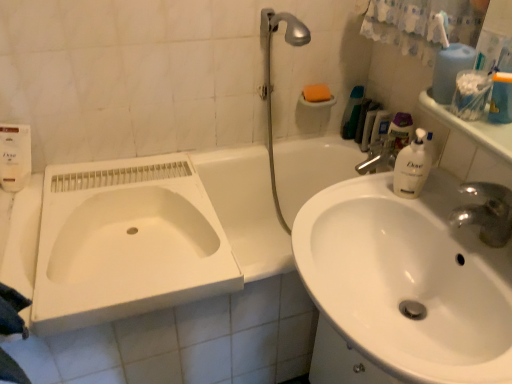
Image resolution: width=512 pixels, height=384 pixels. Describe the element at coordinates (362, 120) in the screenshot. I see `green matte toothpaste tube at upper right, the 2th toiletry from the right` at that location.

Measure the distance between white plastic container at upper right and camera.

A distance of 31.30 inches exists between white plastic container at upper right and camera.

This screenshot has width=512, height=384. What do you see at coordinates (401, 131) in the screenshot? I see `white plastic bottle at upper right, placed as the first toiletry when sorted from right to left` at bounding box center [401, 131].

Measure the distance between point (335, 228) and camera.

Point (335, 228) and camera are 1.03 meters apart.

The width and height of the screenshot is (512, 384). Describe the element at coordinates (316, 93) in the screenshot. I see `orange matte soap at upper center` at that location.

At what (x,y) coordinates should I click in order to perform the action: click on green matte toothpaste tube at upper right, the 2th toiletry from the right. Please return your answer as a coordinate pair (x, y). Looking at the image, I should click on (362, 120).

Is white glossy sink at right in contact with orange matte soap at upper center?

No, white glossy sink at right is not making contact with orange matte soap at upper center.

From a real-world perspective, which is physically below, white glossy sink at right or orange matte soap at upper center?

white glossy sink at right is physically lower.

From the image's perspective, relative to orange matte soap at upper center, is white glossy sink at right above or below?

Clearly, from the image's perspective, white glossy sink at right is below orange matte soap at upper center.

Is white glossy sink at right completely or partially outside of orange matte soap at upper center?

That's correct, white glossy sink at right is outside of orange matte soap at upper center.

Image resolution: width=512 pixels, height=384 pixels. What are the coordinates of `the 1st toiletry located beneath the silver metallic shower head at upper right (from a real-world perspective)` in the screenshot? It's located at (362, 120).

Who is taller, silver metallic shower head at upper right or green matte toothpaste tube at upper right, which appears as the first toiletry when viewed from the left?

With more height is silver metallic shower head at upper right.

From a real-world perspective, is silver metallic shower head at upper right below green matte toothpaste tube at upper right, which appears as the first toiletry when viewed from the left?

Actually, silver metallic shower head at upper right is physically above green matte toothpaste tube at upper right, which appears as the first toiletry when viewed from the left, in the real world.

Is silver metallic shower head at upper right facing away from green matte toothpaste tube at upper right, the 2th toiletry from the right?

No, green matte toothpaste tube at upper right, the 2th toiletry from the right, is not at the back of silver metallic shower head at upper right.

What's the angular difference between silver metallic shower head at upper right and orange matte soap at upper center's facing directions?

silver metallic shower head at upper right and orange matte soap at upper center are facing 0.828 degrees away from each other.

Is point (265, 99) positioned before point (321, 96)?

Yes, point (265, 99) is in front of point (321, 96).

Is silver metallic shower head at upper right thinner than orange matte soap at upper center?

No.

From a real-world perspective, is silver metallic shower head at upper right on orange matte soap at upper center?

No.

How different are the orientations of white glossy bathtub at center and white glossy sink at right in degrees?

The angle between the facing direction of white glossy bathtub at center and the facing direction of white glossy sink at right is 91.8 degrees.

Does white glossy bathtub at center have a greater height compared to white glossy sink at right?

Yes.

Is there a large distance between white glossy bathtub at center and white glossy sink at right?

No, white glossy bathtub at center is not far from white glossy sink at right.

Locate an element on the screen. This screenshot has height=384, width=512. sink that is in front of the white glossy bathtub at center is located at coordinates (402, 286).

Which object is positioned more to the right, white glossy sink at right or white plastic bottle at upper right, the second toiletry in the left-to-right sequence?

Positioned to the right is white plastic bottle at upper right, the second toiletry in the left-to-right sequence.

Based on the photo, is white glossy sink at right placed right next to white plastic bottle at upper right, the second toiletry in the left-to-right sequence?

white glossy sink at right is not next to white plastic bottle at upper right, the second toiletry in the left-to-right sequence, and they're not touching.

Is white glossy sink at right oriented away from white plastic bottle at upper right, the second toiletry in the left-to-right sequence?

No, white glossy sink at right is not facing away from white plastic bottle at upper right, the second toiletry in the left-to-right sequence.

At what (x,y) coordinates should I click in order to perform the action: click on sink that appears above the green matte toothpaste tube at upper right, the 2th toiletry from the right (from a real-world perspective). Please return your answer as a coordinate pair (x, y). Looking at the image, I should click on (402, 286).

From a real-world perspective, is white glossy sink at right beneath green matte toothpaste tube at upper right, which appears as the first toiletry when viewed from the left?

No.

Is white glossy sink at right positioned with its back to green matte toothpaste tube at upper right, the 2th toiletry from the right?

That's not correct — white glossy sink at right is not looking away from green matte toothpaste tube at upper right, the 2th toiletry from the right.

Consider the image. From the image's perspective, which is below, white glossy sink at right or green matte toothpaste tube at upper right, which appears as the first toiletry when viewed from the left?

white glossy sink at right appears lower in the image.

Locate an element on the screen. toiletry behind the clear plastic bottle at upper right, placed as the first mouthwash when sorted from right to left is located at coordinates (362, 120).

Is clear plastic bottle at upper right, the second mouthwash viewed from the left, wider than green matte toothpaste tube at upper right, which appears as the first toiletry when viewed from the left?

Yes, clear plastic bottle at upper right, the second mouthwash viewed from the left, is wider than green matte toothpaste tube at upper right, which appears as the first toiletry when viewed from the left.

From the image's perspective, which one is positioned higher, clear plastic bottle at upper right, the second mouthwash viewed from the left, or green matte toothpaste tube at upper right, the 2th toiletry from the right?

From the image's view, green matte toothpaste tube at upper right, the 2th toiletry from the right, is above.

Is clear plastic bottle at upper right, the 1th mouthwash in the back-to-front sequence, not near green matte toothpaste tube at upper right, the 2th toiletry from the right?

They are positioned close to each other.

Where is `soap on the left of white glossy sink at right`? This screenshot has width=512, height=384. soap on the left of white glossy sink at right is located at coordinates (316, 93).

Where is `shower below the green matte toothpaste tube at upper right, the 2th toiletry from the right (from the image's perspective)`? The width and height of the screenshot is (512, 384). shower below the green matte toothpaste tube at upper right, the 2th toiletry from the right (from the image's perspective) is located at coordinates (270, 78).

When comparing their distances from clear plastic bottle at upper right, the second mouthwash viewed from the left, does white plastic container at upper right or orange matte soap at upper center seem closer?

The object closer to clear plastic bottle at upper right, the second mouthwash viewed from the left, is orange matte soap at upper center.

Based on their spatial positions, is clear plastic container at upper right, the second mouthwash from the right, or white plastic container at upper right closer to green matte toothpaste tube at upper right, the 2th toiletry from the right?

clear plastic container at upper right, the second mouthwash from the right.

When comparing their distances from orange matte soap at upper center, does white plastic container at upper right or white glossy bathtub at center seem closer?

white glossy bathtub at center.

Estimate the real-world distances between objects in this image. Which object is closer to orange matte soap at upper center, silver metallic shower head at upper right or white plastic container at upper right?

The object closer to orange matte soap at upper center is silver metallic shower head at upper right.

From the image, which object appears to be farther from white glossy bathtub at center, white glossy sink at right or green matte toothpaste tube at upper right, which appears as the first toiletry when viewed from the left?

Based on the image, green matte toothpaste tube at upper right, which appears as the first toiletry when viewed from the left, appears to be further to white glossy bathtub at center.

Looking at the image, which one is located closer to white plastic container at upper right, orange matte soap at upper center or silver metallic shower head at upper right?

The object closer to white plastic container at upper right is silver metallic shower head at upper right.

Consider the image. Based on their spatial positions, is white glossy bathtub at center or white plastic bottle at upper right, placed as the first toiletry when sorted from right to left, further from white plastic container at upper right?

Based on the image, white glossy bathtub at center appears to be further to white plastic container at upper right.

When comparing their distances from white plastic container at upper right, does clear plastic container at upper right, which is the second mouthwash in back-to-front order, or clear plastic bottle at upper right, the second mouthwash viewed from the left, seem closer?

Based on the image, clear plastic container at upper right, which is the second mouthwash in back-to-front order, appears to be nearer to white plastic container at upper right.

Find the location of `toiletry between clear plastic container at upper right, arranged as the 1th mouthwash when viewed from the front, and green matte toothpaste tube at upper right, which appears as the first toiletry when viewed from the left, from front to back`. toiletry between clear plastic container at upper right, arranged as the 1th mouthwash when viewed from the front, and green matte toothpaste tube at upper right, which appears as the first toiletry when viewed from the left, from front to back is located at coordinates (401, 131).

Identify the location of mouthwash positioned between silver metallic shower head at upper right and green matte toothpaste tube at upper right, which appears as the first toiletry when viewed from the left, from near to far. The height and width of the screenshot is (384, 512). (380, 125).

What are the coordinates of `counter top between clear plastic container at upper right, arranged as the 1th mouthwash when viewed from the front, and white glossy sink at right, in the vertical direction` in the screenshot? It's located at (472, 127).

The height and width of the screenshot is (384, 512). I want to click on mouthwash between white glossy sink at right and silver metallic shower head at upper right along the z-axis, so click(x=471, y=94).